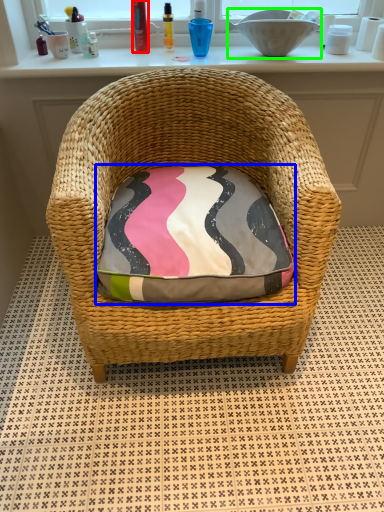
Question: Based on their relative distances, which object is farther from toiletry (highlighted by a red box)? Choose from throw pillow (highlighted by a blue box) and sink (highlighted by a green box).

Choices:
 (A) throw pillow
 (B) sink

Answer: (A)